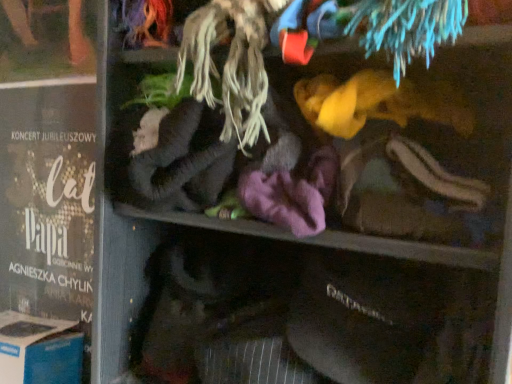
Question: From a real-world perspective, is blue cardboard box at lower left on top of matte black poster at left?

Choices:
 (A) yes
 (B) no

Answer: (B)

Question: Is blue cardboard box at lower left bigger than matte black poster at left?

Choices:
 (A) yes
 (B) no

Answer: (A)

Question: Is blue cardboard box at lower left looking in the opposite direction of matte black poster at left?

Choices:
 (A) no
 (B) yes

Answer: (B)

Question: Considering the relative sizes of blue cardboard box at lower left and matte black poster at left in the image provided, is blue cardboard box at lower left taller than matte black poster at left?

Choices:
 (A) no
 (B) yes

Answer: (A)

Question: Is blue cardboard box at lower left thinner than matte black poster at left?

Choices:
 (A) no
 (B) yes

Answer: (A)

Question: Can you confirm if blue cardboard box at lower left is shorter than matte black poster at left?

Choices:
 (A) yes
 (B) no

Answer: (A)

Question: Does matte black poster at left come in front of blue cardboard box at lower left?

Choices:
 (A) no
 (B) yes

Answer: (A)

Question: Is matte black poster at left not close to blue cardboard box at lower left?

Choices:
 (A) yes
 (B) no

Answer: (B)

Question: Can you confirm if matte black poster at left is thinner than blue cardboard box at lower left?

Choices:
 (A) yes
 (B) no

Answer: (A)

Question: Does matte black poster at left have a smaller size compared to blue cardboard box at lower left?

Choices:
 (A) yes
 (B) no

Answer: (A)

Question: Is the depth of matte black poster at left greater than that of blue cardboard box at lower left?

Choices:
 (A) yes
 (B) no

Answer: (A)

Question: From the image's perspective, is matte black poster at left beneath blue cardboard box at lower left?

Choices:
 (A) yes
 (B) no

Answer: (B)

Question: Considering the positions of matte black poster at left and blue cardboard box at lower left in the image, is matte black poster at left taller or shorter than blue cardboard box at lower left?

Choices:
 (A) short
 (B) tall

Answer: (B)